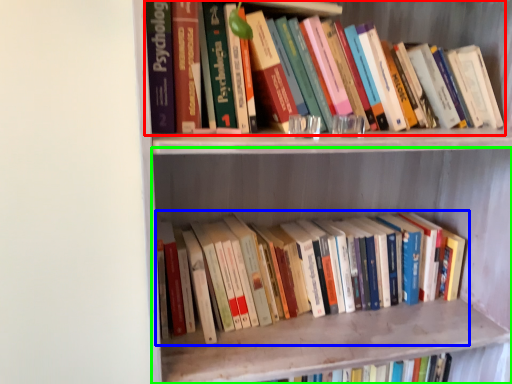
Question: Which is farther away from book (highlighted by a red box)? book (highlighted by a blue box) or shelf (highlighted by a green box)?

Choices:
 (A) book
 (B) shelf

Answer: (A)